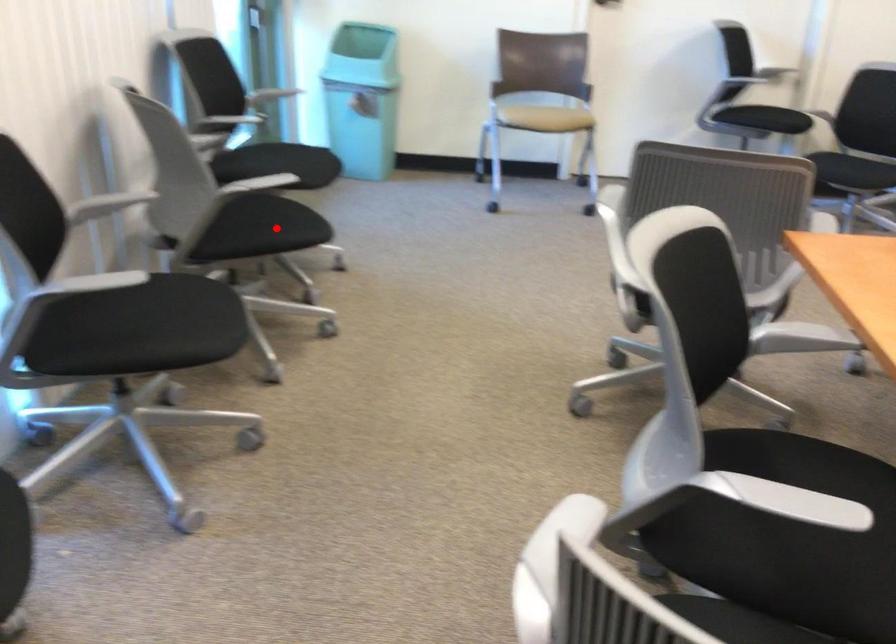
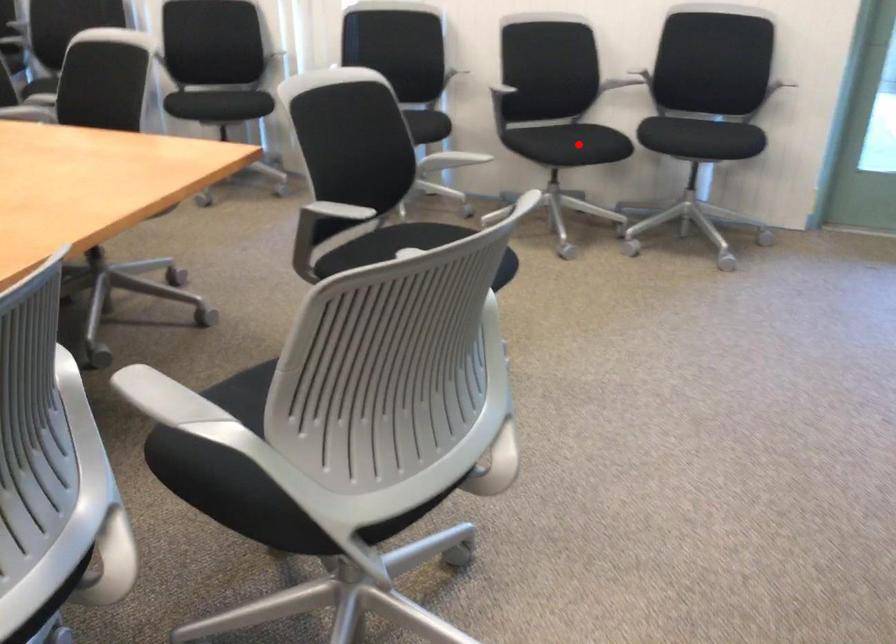
I am providing you with two images of the same scene from different viewpoints. A red point is marked on the first image and another point is marked on the second image. Do the highlighted points in image1 and image2 indicate the same real-world spot?

Yes